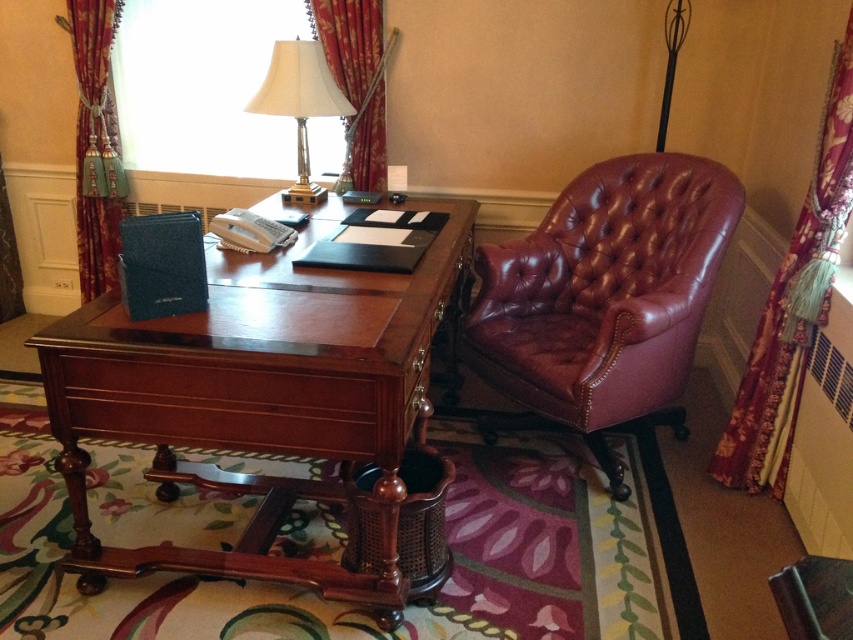
Question: Is floral fabric curtain at right closer to camera compared to velvet burgundy curtain at upper left?

Choices:
 (A) yes
 (B) no

Answer: (A)

Question: In this image, where is mahogany wood desk at center located relative to velvet burgundy curtain at upper left?

Choices:
 (A) below
 (B) above

Answer: (A)

Question: Which point appears closest to the camera in this image?

Choices:
 (A) (318, 99)
 (B) (77, 225)
 (C) (833, 179)
 (D) (61, 369)

Answer: (D)

Question: Which object is positioned closest to the velvet burgundy curtain at upper left?

Choices:
 (A) floral fabric curtain at right
 (B) mahogany wood desk at center
 (C) oxblood leather swivel chair at right

Answer: (B)

Question: Estimate the real-world distances between objects in this image. Which object is closer to the oxblood leather swivel chair at right?

Choices:
 (A) white fabric lampshade at upper center
 (B) mahogany wood desk at center
 (C) velvet burgundy curtain at upper left

Answer: (B)

Question: Does oxblood leather swivel chair at right appear on the right side of white fabric lampshade at upper center?

Choices:
 (A) no
 (B) yes

Answer: (B)